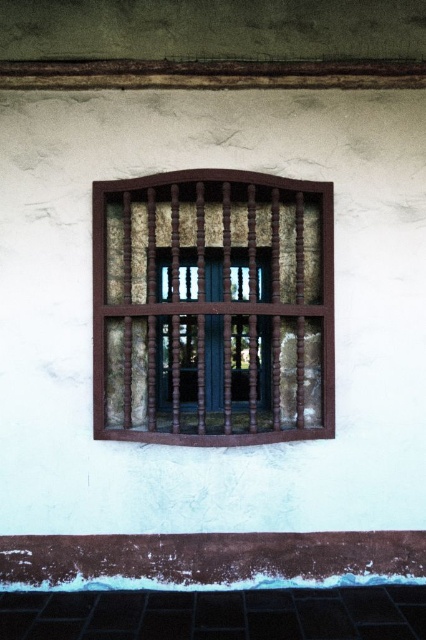
You are standing in front of a building with a window. There is a point at coordinate (x=213, y=308). What object does this point correspond to?

The point at coordinate (x=213, y=308) corresponds to the brown wooden window frame at center.

You are standing in front of the building and want to know which of the two points, point (296, 180) or point (161, 372), is closer to you. Can you determine this based on their positions?

Point (296, 180) is in front of point (161, 372), so it is closer to you.